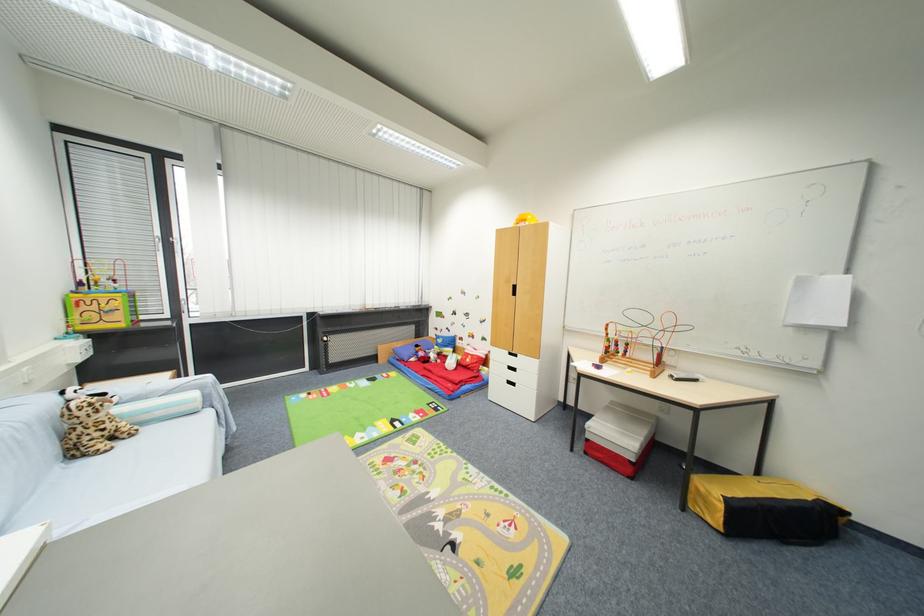
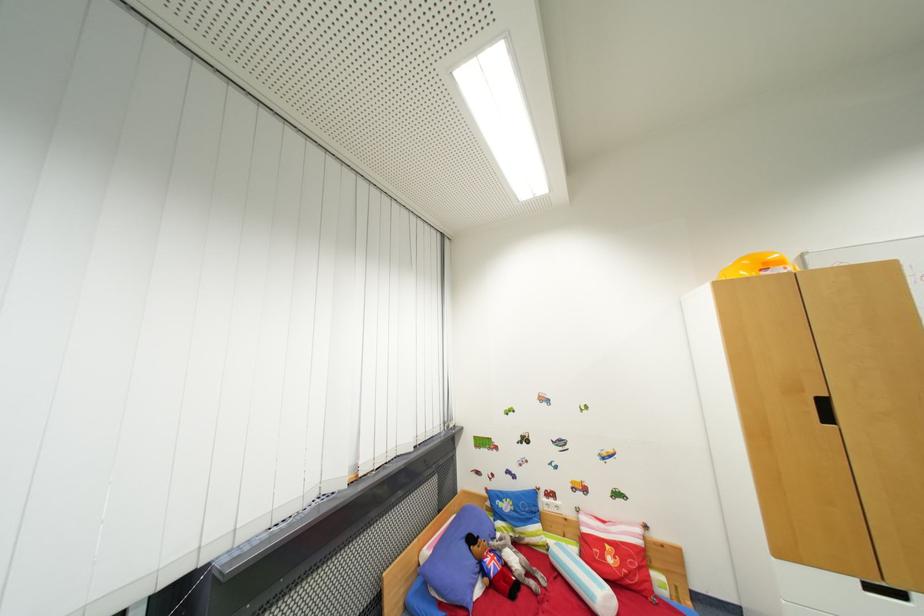
Find the pixel in the second image that matches (x=472, y=362) in the first image.

(614, 562)